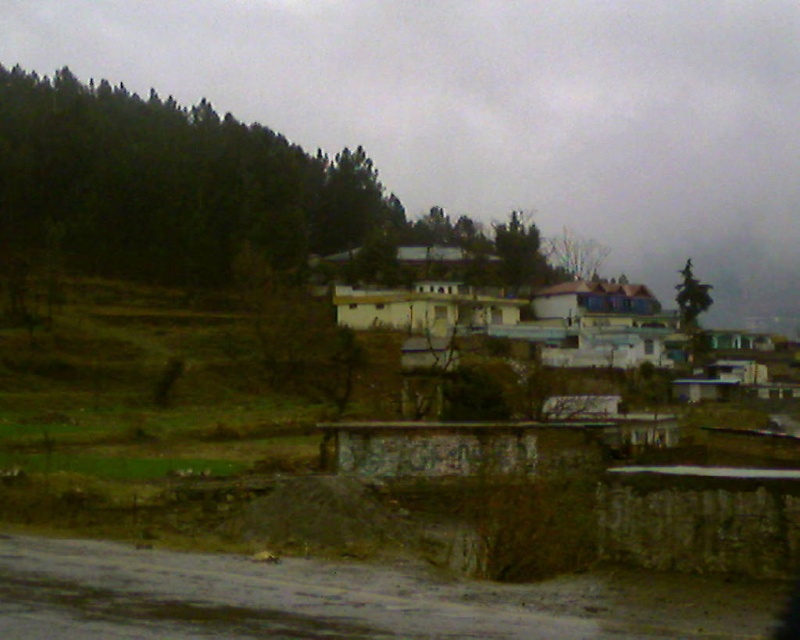
You are standing at the point marked as point (520, 252) in the image. Looking around, you see a green matte tree at upper center. What is directly in front of you?

The green matte tree at upper center is directly in front of you at point (520, 252).

You are standing at point (x=169, y=182) in the image. What do you see to your left?

To your left at point (x=169, y=182), you see green leafy trees.

You are standing on the dirt road in the rural landscape and notice two green leafy trees. One is labeled as green leafy trees at left and the other as green leafy tree at upper right. Which tree appears closer to you based on their positions?

The green leafy trees at left appears closer because it is positioned in front of the green leafy tree at upper right.